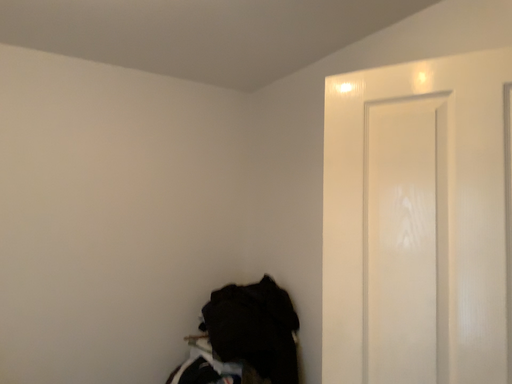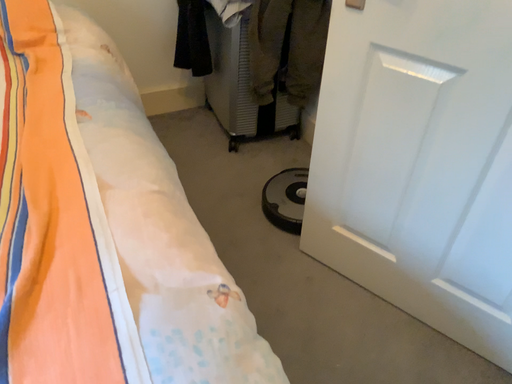
Question: How did the camera likely rotate when shooting the video?

Choices:
 (A) rotated downward
 (B) rotated upward

Answer: (A)